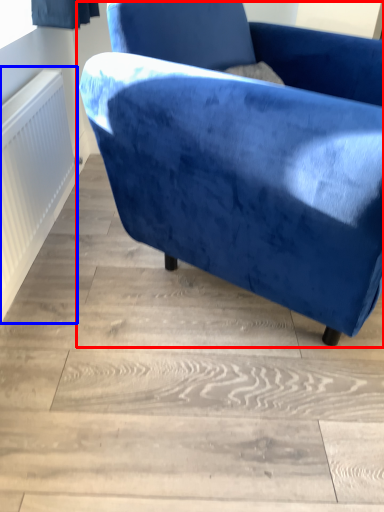
Question: Which point is further to the camera, chair (highlighted by a red box) or radiator (highlighted by a blue box)?

Choices:
 (A) chair
 (B) radiator

Answer: (B)